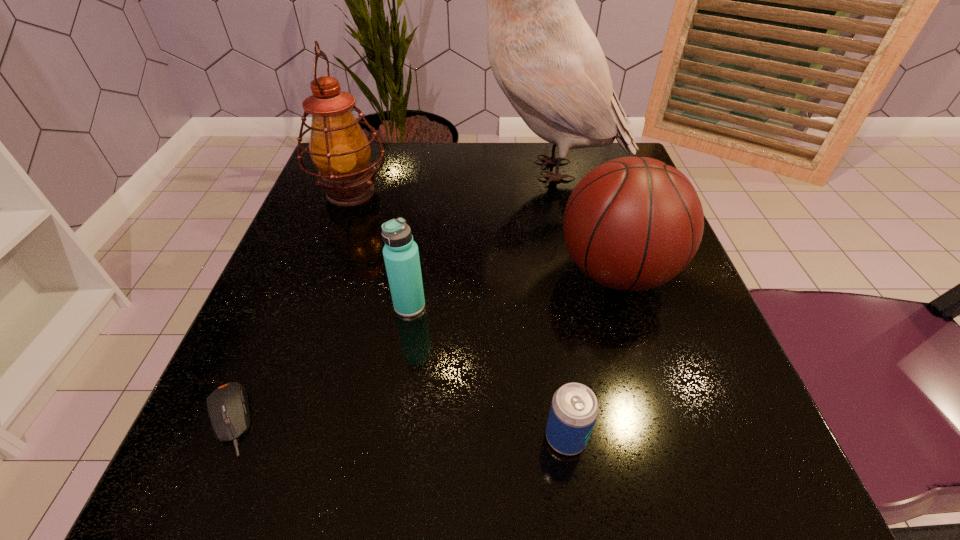
The image size is (960, 540). What are the coordinates of `free space located 0.090m on the back of the fifth shortest object` in the screenshot? It's located at (366, 150).

This screenshot has width=960, height=540. Identify the location of vacant space located on the back of the basketball. (598, 214).

Locate an element on the screen. The image size is (960, 540). free space located 0.060m on the front of the fourth tallest object is located at coordinates click(403, 349).

This screenshot has height=540, width=960. What are the coordinates of `blank space located on the right of the second shortest object` in the screenshot? It's located at (660, 437).

Locate an element on the screen. Image resolution: width=960 pixels, height=540 pixels. vacant point located 0.240m on the right of the computer mouse is located at coordinates (443, 419).

Find the location of a particular element. This screenshot has height=540, width=960. parakeet located at the far edge is located at coordinates (544, 56).

The width and height of the screenshot is (960, 540). In order to click on oil lamp situated at the far edge in this screenshot , I will do (340, 150).

Where is `beer can located in the near edge section of the desktop`? Image resolution: width=960 pixels, height=540 pixels. beer can located in the near edge section of the desktop is located at coordinates (574, 409).

What are the coordinates of `computer mouse that is at the near edge` in the screenshot? It's located at (228, 408).

You are a GUI agent. You are given a task and a screenshot of the screen. Output one action in this format:
    pyautogui.click(x=<x>, y=<y>)
    Task: Click on the oil lamp located at the left edge
    Image resolution: width=960 pixels, height=540 pixels.
    Given the screenshot: What is the action you would take?
    pyautogui.click(x=340, y=150)